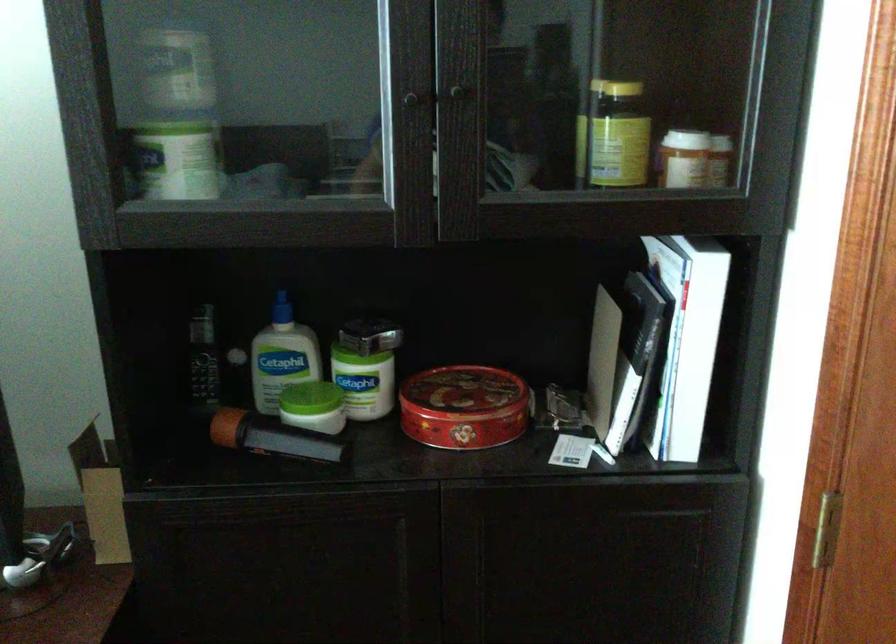
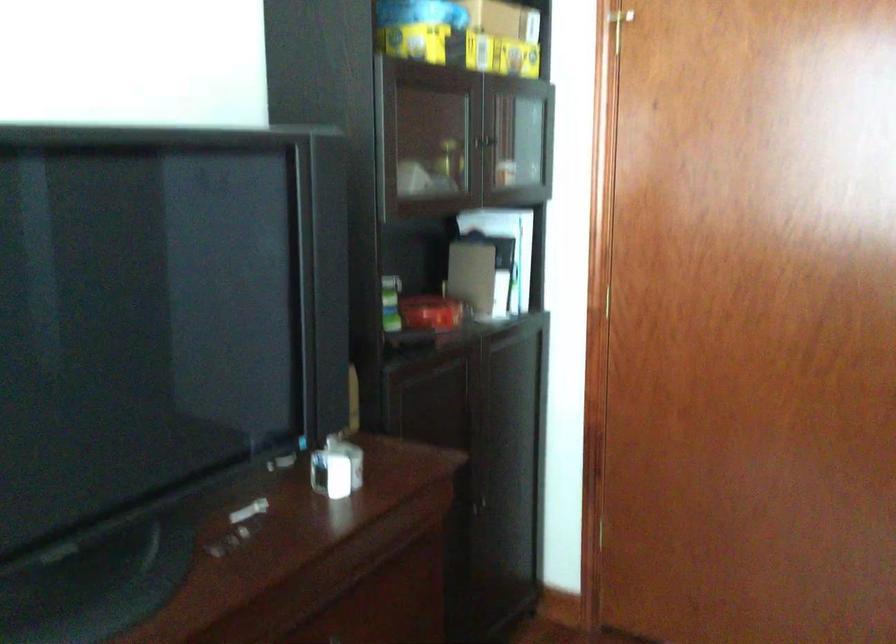
Where in the second image is the point corresponding to point (467, 104) from the first image?

(492, 140)